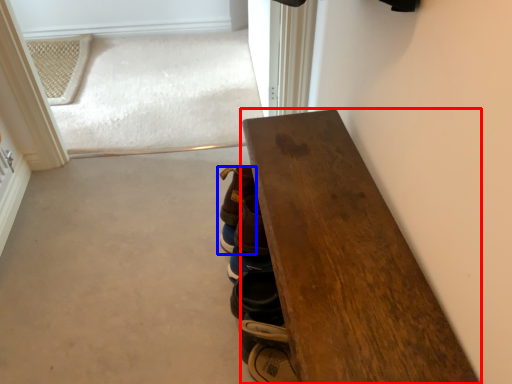
Question: Which of the following is the closest to the observer, table (highlighted by a red box) or footwear (highlighted by a blue box)?

Choices:
 (A) table
 (B) footwear

Answer: (A)